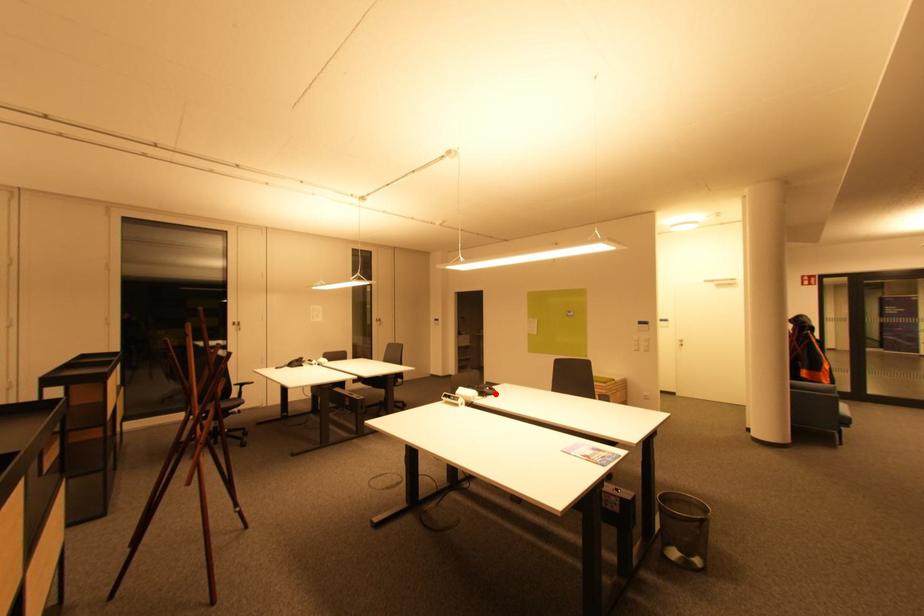
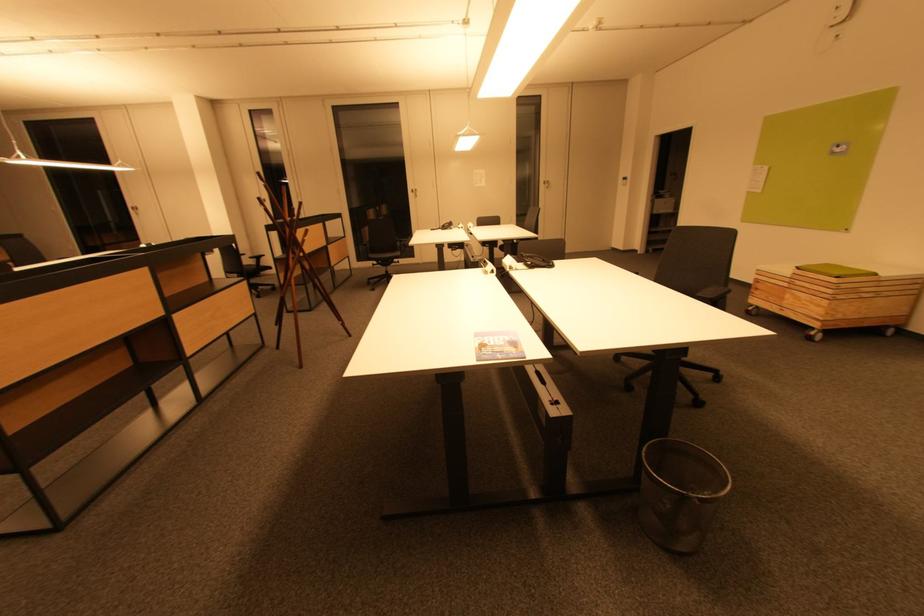
Question: I am providing you with two images of the same scene from different viewpoints. Image1 has a red point marked. In image2, the corresponding 3D location appears at what relative position? Reply with the corresponding letter.

Choices:
 (A) Closer
 (B) Farther

Answer: (B)